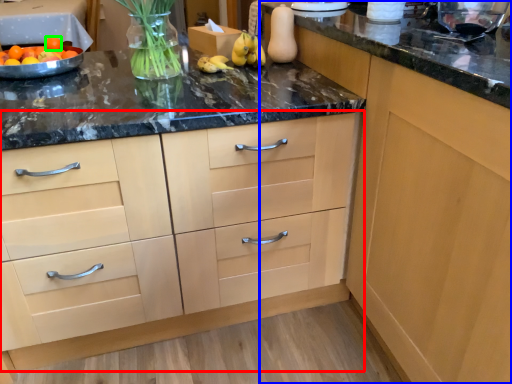
Question: Which object is the closest to the cabinetry (highlighted by a red box)? Choose among these: cabinetry (highlighted by a blue box) or tangerine (highlighted by a green box).

Choices:
 (A) cabinetry
 (B) tangerine

Answer: (A)